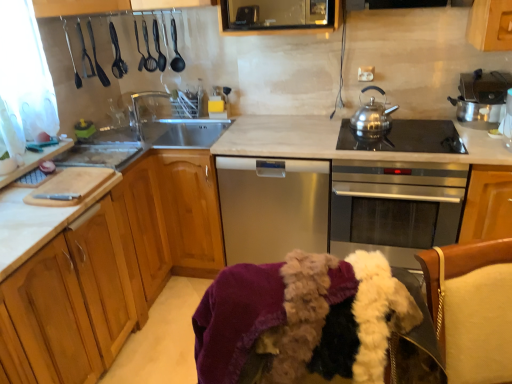
This screenshot has height=384, width=512. I want to click on light wood cabinet at left, the second cabinetry positioned from the right, so click(x=109, y=268).

From the picture: What is the approximate height of black glass cooktop at center-right?

black glass cooktop at center-right is 1.26 inches in height.

What do you see at coordinates (272, 207) in the screenshot? I see `satin silver dishwasher at center` at bounding box center [272, 207].

Locate an element on the screen. shiny metallic pot at upper right, the second appliance when ordered from left to right is located at coordinates (482, 98).

What do you see at coordinates (190, 210) in the screenshot? I see `wooden cabinet at center, which is counted as the first cabinetry, starting from the right` at bounding box center [190, 210].

Image resolution: width=512 pixels, height=384 pixels. Find the location of `white marble countertop at center`. white marble countertop at center is located at coordinates (382, 159).

Locate an element on the screen. light wood cabinet at left, the second cabinetry positioned from the right is located at coordinates (109, 268).

Where is `appliance that is the 1st one above the satin silver dishwasher at center (from a real-world perspective)`? This screenshot has width=512, height=384. appliance that is the 1st one above the satin silver dishwasher at center (from a real-world perspective) is located at coordinates (482, 98).

From the image's perspective, relative to shiny metallic pot at upper right, the second appliance from the top, is satin silver dishwasher at center above or below?

satin silver dishwasher at center is below shiny metallic pot at upper right, the second appliance from the top.

In the image, is satin silver dishwasher at center positioned in front of or behind shiny metallic pot at upper right, the second appliance from the top?

satin silver dishwasher at center is behind shiny metallic pot at upper right, the second appliance from the top.

Is satin silver dishwasher at center positioned beyond the bounds of shiny metallic pot at upper right, arranged as the first appliance when ordered from the bottom?

Yes, satin silver dishwasher at center is located beyond the bounds of shiny metallic pot at upper right, arranged as the first appliance when ordered from the bottom.

This screenshot has height=384, width=512. Find the location of `swivel chair that is above the light wood cabinet at left, the second cabinetry positioned from the right (from a real-world perspective)`. swivel chair that is above the light wood cabinet at left, the second cabinetry positioned from the right (from a real-world perspective) is located at coordinates (477, 312).

Can you confirm if white fabric swivel chair at lower right is bigger than light wood cabinet at left, which appears as the 1th cabinetry when viewed from the left?

Incorrect, white fabric swivel chair at lower right is not larger than light wood cabinet at left, which appears as the 1th cabinetry when viewed from the left.

Which of these two, white fabric swivel chair at lower right or light wood cabinet at left, the second cabinetry positioned from the right, stands taller?

Standing taller between the two is light wood cabinet at left, the second cabinetry positioned from the right.

Which is farther, (x=471, y=310) or (x=131, y=266)?

Positioned behind is point (x=131, y=266).

From the picture: Choose the correct answer: Is transparent glass tap at center inside wooden cabinet at center, which ranks as the second cabinetry in left-to-right order, or outside it?

transparent glass tap at center is spatially situated outside wooden cabinet at center, which ranks as the second cabinetry in left-to-right order.

Consider the image. Would you consider transparent glass tap at center to be distant from wooden cabinet at center, which ranks as the second cabinetry in left-to-right order?

transparent glass tap at center is actually quite close to wooden cabinet at center, which ranks as the second cabinetry in left-to-right order.

Is stainless steel teapot at upper right facing away from satin silver dishwasher at center?

No.

Does stainless steel teapot at upper right have a lesser height compared to satin silver dishwasher at center?

Yes.

Which is in front, point (381, 108) or point (278, 209)?

The point (278, 209) is closer to the camera.

In the scene shown: Is shiny metallic pot at upper right, arranged as the first appliance when viewed from the right, spatially inside stainless steel teapot at upper right, or outside of it?

shiny metallic pot at upper right, arranged as the first appliance when viewed from the right, is outside stainless steel teapot at upper right.

Is shiny metallic pot at upper right, arranged as the first appliance when ordered from the bottom, in front of or behind stainless steel teapot at upper right in the image?

Visually, shiny metallic pot at upper right, arranged as the first appliance when ordered from the bottom, is located in front of stainless steel teapot at upper right.

At what (x,y) coordinates should I click in order to perform the action: click on tea pot below the shiny metallic pot at upper right, arranged as the first appliance when ordered from the bottom (from a real-world perspective). Please return your answer as a coordinate pair (x, y). Looking at the image, I should click on (371, 121).

Is shiny metallic pot at upper right, arranged as the first appliance when viewed from the right, bigger or smaller than stainless steel teapot at upper right?

In the image, shiny metallic pot at upper right, arranged as the first appliance when viewed from the right, appears to be larger than stainless steel teapot at upper right.

Which point is more forward, (484, 82) or (175, 43)?

The point (484, 82) is more forward.

Based on their sizes in the image, would you say shiny metallic pot at upper right, the second appliance when ordered from left to right, is bigger or smaller than black plastic spoon at upper center, placed as the 2th appliance when sorted from right to left?

Clearly, shiny metallic pot at upper right, the second appliance when ordered from left to right, is larger in size than black plastic spoon at upper center, placed as the 2th appliance when sorted from right to left.

From a real-world perspective, who is located lower, shiny metallic pot at upper right, the second appliance when ordered from left to right, or black plastic spoon at upper center, arranged as the 1th appliance when viewed from the top?

shiny metallic pot at upper right, the second appliance when ordered from left to right.

Is wooden cabinet at center, which ranks as the second cabinetry in left-to-right order, turned away from stainless steel oven at center?

wooden cabinet at center, which ranks as the second cabinetry in left-to-right order, does not have its back to stainless steel oven at center.

Which of these two, wooden cabinet at center, which is counted as the first cabinetry, starting from the right, or stainless steel oven at center, stands taller?

Standing taller between the two is wooden cabinet at center, which is counted as the first cabinetry, starting from the right.

From a real-world perspective, is wooden cabinet at center, which ranks as the second cabinetry in left-to-right order, positioned above or below stainless steel oven at center?

wooden cabinet at center, which ranks as the second cabinetry in left-to-right order, is situated lower than stainless steel oven at center in the real world.

Considering the positions of objects wooden cabinet at center, which is counted as the first cabinetry, starting from the right, and stainless steel oven at center in the image provided, who is behind, wooden cabinet at center, which is counted as the first cabinetry, starting from the right, or stainless steel oven at center?

wooden cabinet at center, which is counted as the first cabinetry, starting from the right.

The width and height of the screenshot is (512, 384). Identify the location of appliance on the right of satin silver dishwasher at center. (482, 98).

The image size is (512, 384). In order to click on cabinetry that is the 2nd one when counting leftward from the white fabric swivel chair at lower right in this screenshot , I will do `click(109, 268)`.

Based on their spatial positions, is satin silver dishwasher at center or shiny metallic pot at upper right, the second appliance from the top, further from white fabric swivel chair at lower right?

shiny metallic pot at upper right, the second appliance from the top, is positioned further to the anchor white fabric swivel chair at lower right.

When comparing their distances from black plastic spoon at upper center, positioned as the 2th appliance in bottom-to-top order, does white marble countertop at center or shiny metallic pot at upper right, the second appliance from the top, seem further?

shiny metallic pot at upper right, the second appliance from the top, is positioned further to the anchor black plastic spoon at upper center, positioned as the 2th appliance in bottom-to-top order.

When comparing their distances from black glass cooktop at center-right, does white fabric swivel chair at lower right or satin silver dishwasher at center seem further?

The object further to black glass cooktop at center-right is white fabric swivel chair at lower right.

When comparing their distances from satin silver dishwasher at center, does black glass cooktop at center-right or stainless steel oven at center seem further?

The object further to satin silver dishwasher at center is black glass cooktop at center-right.

Which object lies nearer to the anchor point black glass cooktop at center-right, satin silver dishwasher at center or stainless steel oven at center?

Based on the image, stainless steel oven at center appears to be nearer to black glass cooktop at center-right.

When comparing their distances from shiny metallic pot at upper right, arranged as the first appliance when ordered from the bottom, does black glass cooktop at center-right or transparent glass tap at center seem further?

transparent glass tap at center is positioned further to the anchor shiny metallic pot at upper right, arranged as the first appliance when ordered from the bottom.

Based on the photo, which object lies further to the anchor point wooden cabinet at center, which is counted as the first cabinetry, starting from the right, white fabric swivel chair at lower right or black glass cooktop at center-right?

white fabric swivel chair at lower right is further to wooden cabinet at center, which is counted as the first cabinetry, starting from the right.

From the image, which object appears to be farther from white marble countertop at center, light wood cabinet at left, which appears as the 1th cabinetry when viewed from the left, or shiny metallic pot at upper right, the second appliance when ordered from left to right?

light wood cabinet at left, which appears as the 1th cabinetry when viewed from the left, lies further to white marble countertop at center than the other object.

Where is `oven located between transparent glass tap at center and black glass cooktop at center-right in the left-right direction`? This screenshot has width=512, height=384. oven located between transparent glass tap at center and black glass cooktop at center-right in the left-right direction is located at coordinates (395, 207).

You are a GUI agent. You are given a task and a screenshot of the screen. Output one action in this format:
    pyautogui.click(x=<x>, y=<y>)
    Task: Click on the cabinetry between black plastic spoon at upper center, the first appliance when ordered from left to right, and satin silver dishwasher at center, in the vertical direction
    The height and width of the screenshot is (384, 512).
    Given the screenshot: What is the action you would take?
    pyautogui.click(x=190, y=210)

Where is `cabinetry located between light wood cabinet at left, the second cabinetry positioned from the right, and shiny metallic pot at upper right, arranged as the first appliance when ordered from the bottom, in the left-right direction`? Image resolution: width=512 pixels, height=384 pixels. cabinetry located between light wood cabinet at left, the second cabinetry positioned from the right, and shiny metallic pot at upper right, arranged as the first appliance when ordered from the bottom, in the left-right direction is located at coordinates (190, 210).

In order to click on home appliance located between white fabric swivel chair at lower right and wooden cabinet at center, which ranks as the second cabinetry in left-to-right order, in the depth direction in this screenshot , I will do `click(272, 207)`.